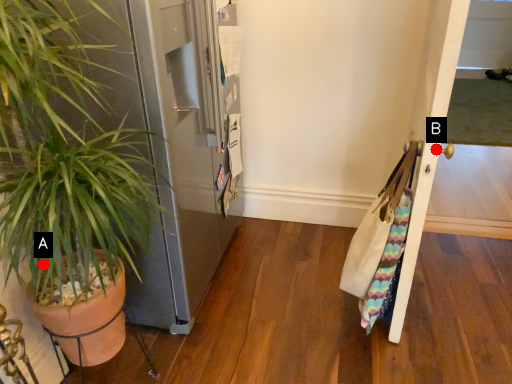
Question: Two points are circled on the image, labeled by A and B beside each circle. Among these points, which one is nearest to the camera?

Choices:
 (A) A is closer
 (B) B is closer

Answer: (A)